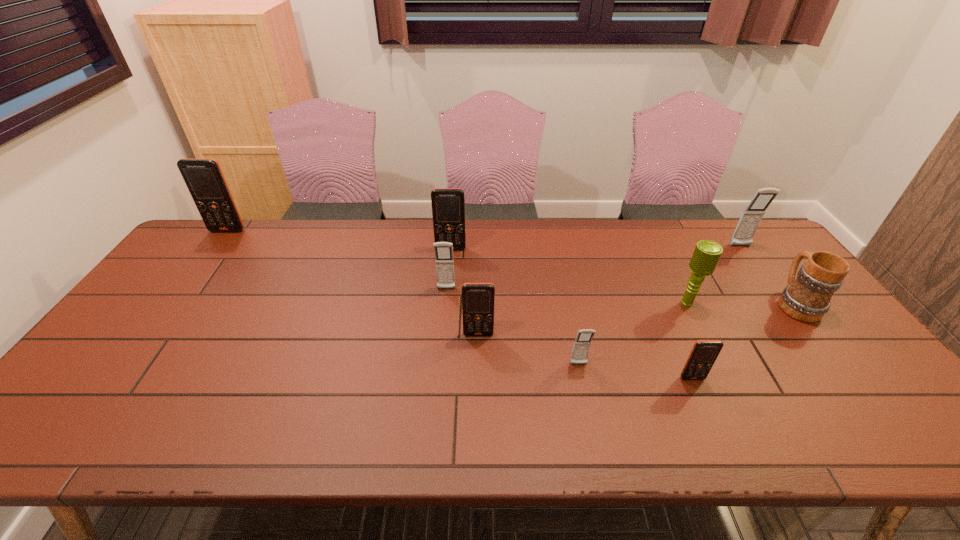
Find the location of a particular element. This screenshot has width=960, height=540. free space between the mug and the sixth farthest cellular telephone is located at coordinates (687, 334).

The height and width of the screenshot is (540, 960). I want to click on empty space between the sixth object from right to left and the seventh object from left to right, so click(x=583, y=319).

Where is `vacant point located between the third nearest orange cellular telephone and the sixth object from left to right`? vacant point located between the third nearest orange cellular telephone and the sixth object from left to right is located at coordinates (571, 314).

Select which object appears as the second closest to the leftmost gray cellular telephone. Please provide its 2D coordinates. Your answer should be formatted as a tuple, i.e. [(x, y)], where the tuple contains the x and y coordinates of a point satisfying the conditions above.

[(448, 204)]

Locate an element on the screen. The height and width of the screenshot is (540, 960). object that is the second closest one to the nearest object is located at coordinates (582, 343).

Image resolution: width=960 pixels, height=540 pixels. Identify the location of the sixth closest cellular telephone to the tallest object. (743, 235).

The width and height of the screenshot is (960, 540). Identify the location of cellular telephone that is the second closest to the second nearest cellular telephone. (704, 353).

Where is `orange cellular telephone that is the closest one to the rightmost orange cellular telephone`? orange cellular telephone that is the closest one to the rightmost orange cellular telephone is located at coordinates (478, 299).

Locate an element on the screen. the closest orange cellular telephone relative to the eighth farthest object is located at coordinates (478, 299).

This screenshot has height=540, width=960. I want to click on gray cellular telephone that can be found as the third closest to the nearest object, so click(444, 259).